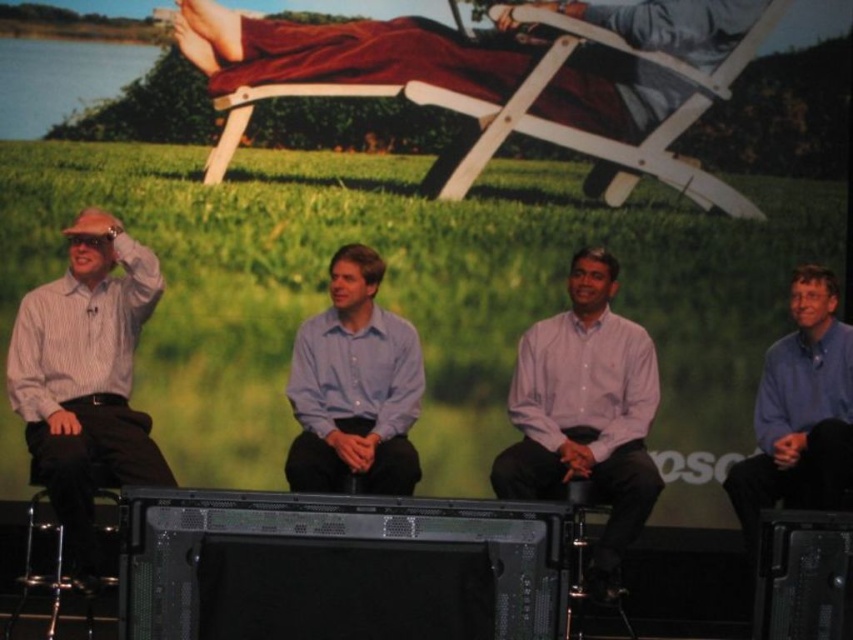
You are an event planner arranging seating for a panel discussion. You need to place a name tag on the table in front of each speaker. The name tags are different heights to match the speakers. The light blue shirt at center and the blue shirt at right are two of the speakers. Which speaker should get the taller name tag?

The blue shirt at right should receive the taller name tag because the light blue shirt at center is shorter than the blue shirt at right according to the description.

You are organizing a photo shoot and need to ensure that the light blue shirt at center and the white wood beach chair at upper center are both visible in the frame. Given their sizes, which object should you prioritize positioning closer to the camera to maintain clarity?

The light blue shirt at center has a lesser width compared to the white wood beach chair at upper center, so you should prioritize positioning the light blue shirt at center closer to the camera to ensure it remains visible and clear in the frame.

You are a photographer setting up for a group photo. You need to position the blue shirt at right so that it is visible in the frame without being blocked by the white wood beach chair at upper center. Based on the current arrangement, is this possible?

The blue shirt at right is behind the white wood beach chair at upper center, so it would be blocked and not visible. To make the blue shirt at right visible, you need to move it in front of the white wood beach chair at upper center.